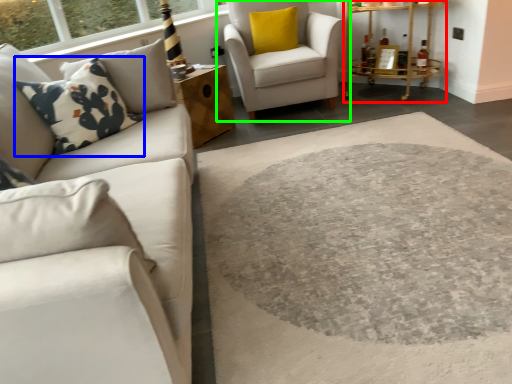
Question: Estimate the real-world distances between objects in this image. Which object is closer to table (highlighted by a red box), throw pillow (highlighted by a blue box) or chair (highlighted by a green box)?

Choices:
 (A) throw pillow
 (B) chair

Answer: (B)